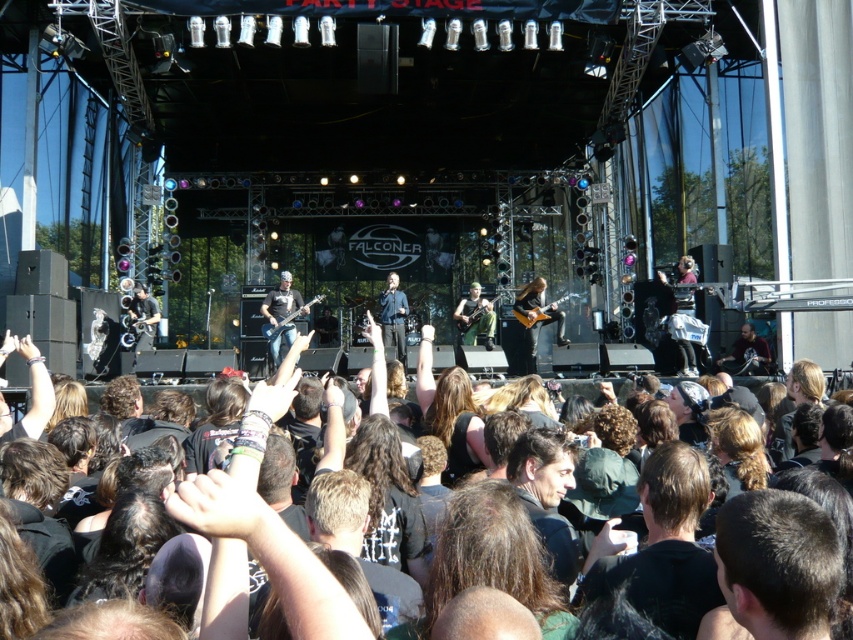
Can you confirm if black t-shirt at center is thinner than dark brown hair at center?

Incorrect, black t-shirt at center's width is not less than dark brown hair at center's.

Can you confirm if black t-shirt at center is taller than dark brown hair at center?

Yes.

Is point (675, 604) positioned behind point (758, 492)?

Yes.

I want to click on black t-shirt at center, so click(656, 560).